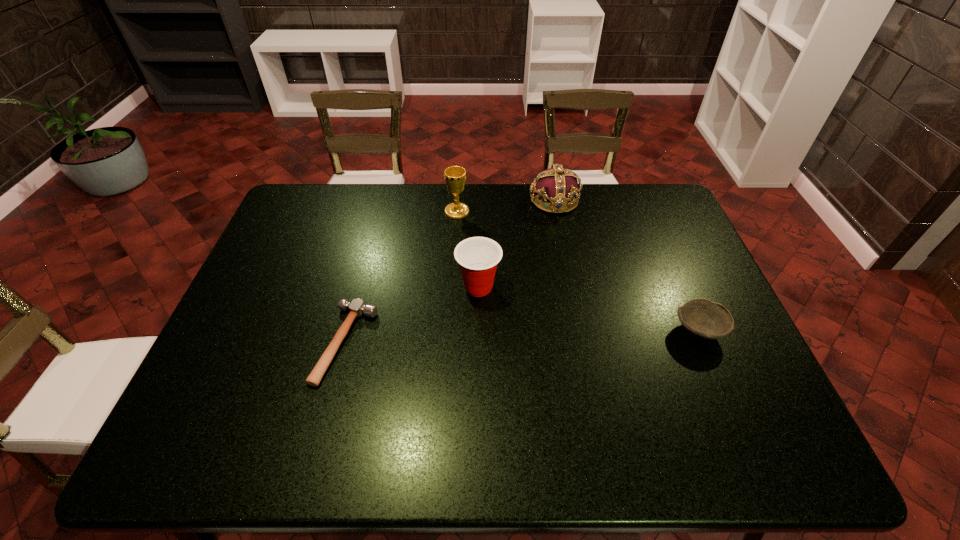
The height and width of the screenshot is (540, 960). Identify the location of free space located on the back of the rightmost object. pyautogui.click(x=666, y=256).

The image size is (960, 540). Identify the location of vacant point located 0.250m on the left of the leftmost object. (223, 343).

At what (x,y) coordinates should I click in order to perform the action: click on chalice located at the far edge. Please return your answer as a coordinate pair (x, y). Looking at the image, I should click on [x=455, y=176].

You are a GUI agent. You are given a task and a screenshot of the screen. Output one action in this format:
    pyautogui.click(x=<x>, y=<y>)
    Task: Click on the crown at the far edge
    This screenshot has height=540, width=960.
    Given the screenshot: What is the action you would take?
    pyautogui.click(x=557, y=185)

The height and width of the screenshot is (540, 960). In order to click on object situated at the right edge in this screenshot , I will do `click(702, 318)`.

At what (x,y) coordinates should I click in order to perform the action: click on free spot at the far edge of the desktop. Please return your answer as a coordinate pair (x, y). The width and height of the screenshot is (960, 540). Looking at the image, I should click on (363, 209).

In the image, there is a desktop. At what (x,y) coordinates should I click in order to perform the action: click on vacant space at the near edge. Please return your answer as a coordinate pair (x, y). This screenshot has width=960, height=540. Looking at the image, I should click on (546, 428).

Locate an element on the screen. free space at the left edge of the desktop is located at coordinates (275, 327).

Where is `vacant space at the right edge`? The image size is (960, 540). vacant space at the right edge is located at coordinates (681, 266).

Find the location of `blank space at the far left corner of the desktop`. blank space at the far left corner of the desktop is located at coordinates click(x=305, y=192).